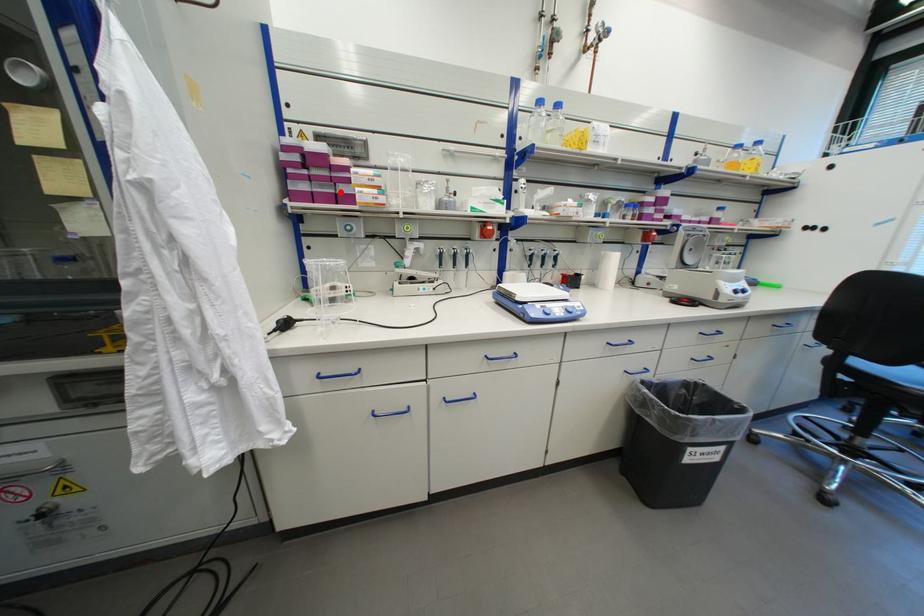
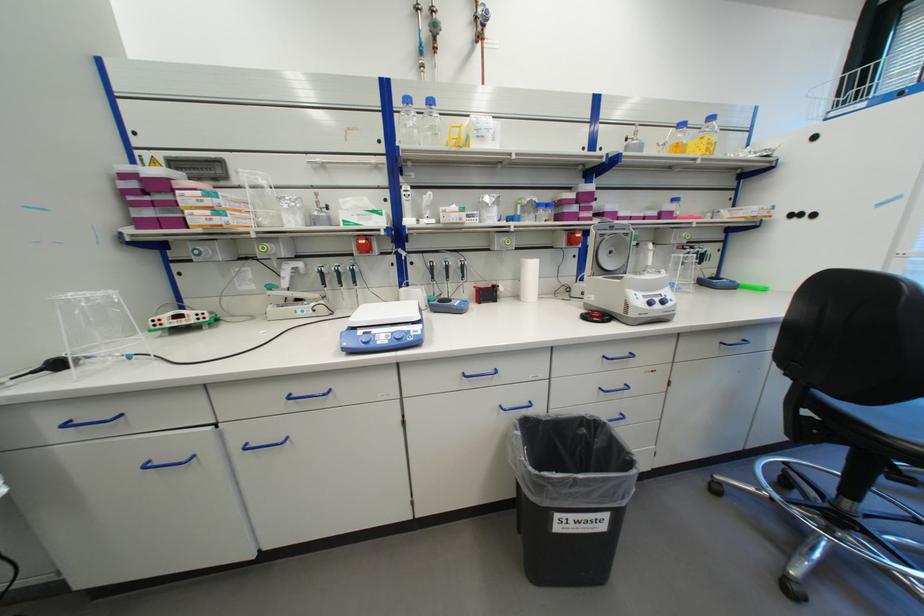
The point at the highlighted location is marked in the first image. Where is the corresponding point in the second image?

(188, 216)